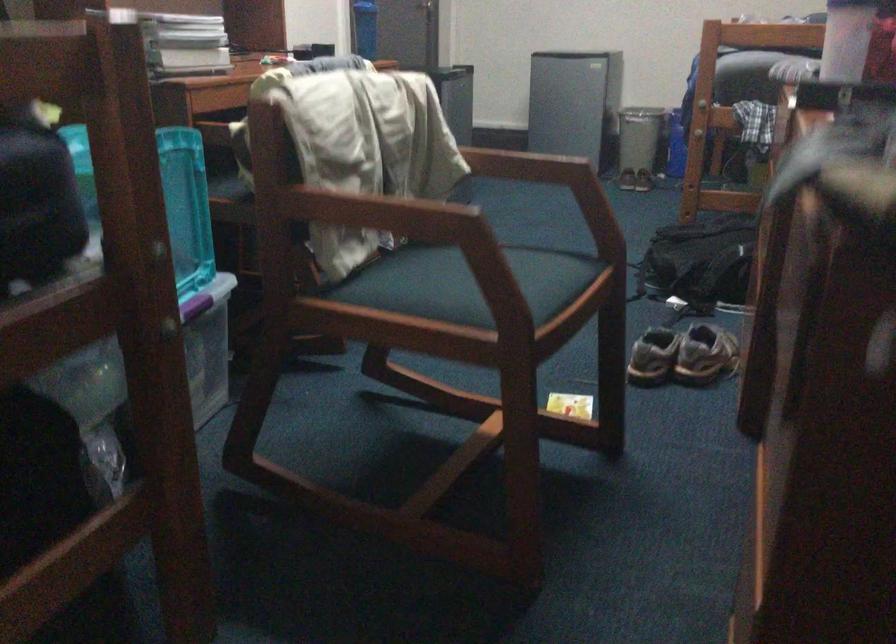
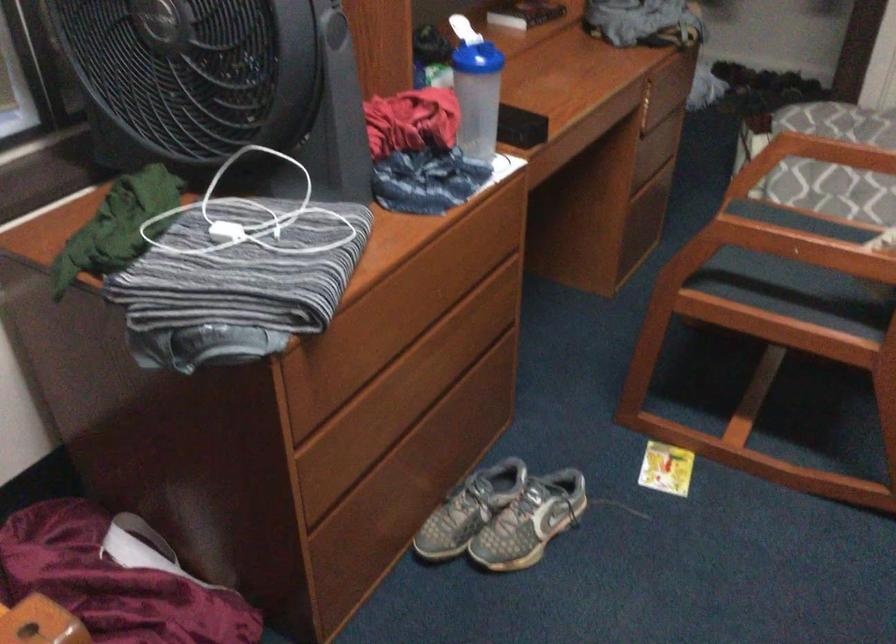
In the second image, find the point that corresponds to the point at 574,409 in the first image.

(666, 468)